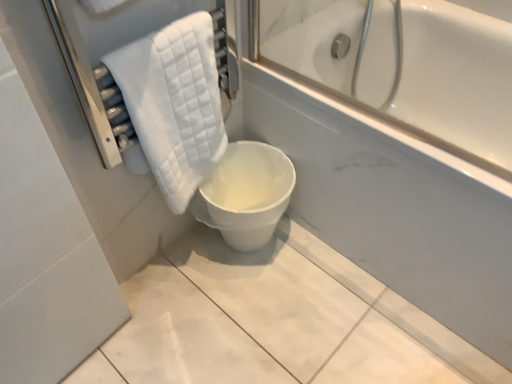
Question: Is white quilted towel at left at the right side of white glossy toilet at center?

Choices:
 (A) yes
 (B) no

Answer: (B)

Question: Is white quilted towel at left in front of white glossy toilet at center?

Choices:
 (A) no
 (B) yes

Answer: (B)

Question: From a real-world perspective, is white quilted towel at left below white glossy toilet at center?

Choices:
 (A) yes
 (B) no

Answer: (B)

Question: Is white quilted towel at left outside white glossy toilet at center?

Choices:
 (A) yes
 (B) no

Answer: (A)

Question: Are white quilted towel at left and white glossy toilet at center located far from each other?

Choices:
 (A) yes
 (B) no

Answer: (B)

Question: Can you confirm if white quilted towel at left is taller than white glossy toilet at center?

Choices:
 (A) no
 (B) yes

Answer: (B)

Question: From a real-world perspective, is white glossy toilet at center beneath white quilted towel at left?

Choices:
 (A) no
 (B) yes

Answer: (B)

Question: Is white glossy toilet at center aimed at white quilted towel at left?

Choices:
 (A) no
 (B) yes

Answer: (A)

Question: From a real-world perspective, is white glossy toilet at center on top of white quilted towel at left?

Choices:
 (A) yes
 (B) no

Answer: (B)

Question: Is white glossy toilet at center not close to white quilted towel at left?

Choices:
 (A) yes
 (B) no

Answer: (B)

Question: Is white glossy toilet at center next to white quilted towel at left?

Choices:
 (A) yes
 (B) no

Answer: (B)

Question: From the image's perspective, is white glossy toilet at center on top of white quilted towel at left?

Choices:
 (A) no
 (B) yes

Answer: (A)

Question: Is white glossy toilet at center inside the boundaries of white quilted towel at left, or outside?

Choices:
 (A) outside
 (B) inside

Answer: (A)